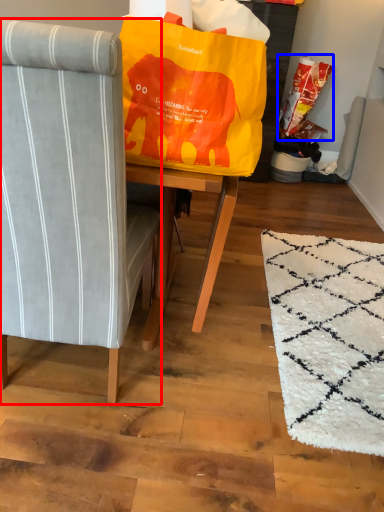
Question: Which point is further to the camera, chair (highlighted by a red box) or grocery bag (highlighted by a blue box)?

Choices:
 (A) chair
 (B) grocery bag

Answer: (B)